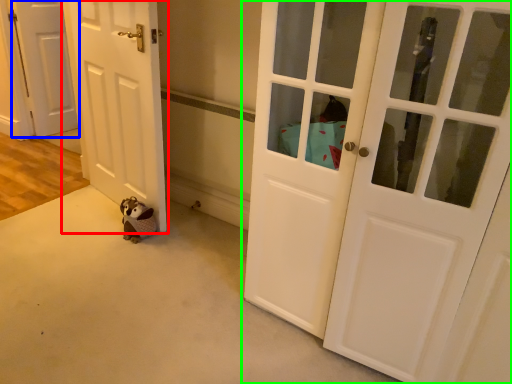
Question: Which is farther away from door (highlighted by a red box)? door (highlighted by a blue box) or door (highlighted by a green box)?

Choices:
 (A) door
 (B) door

Answer: (A)